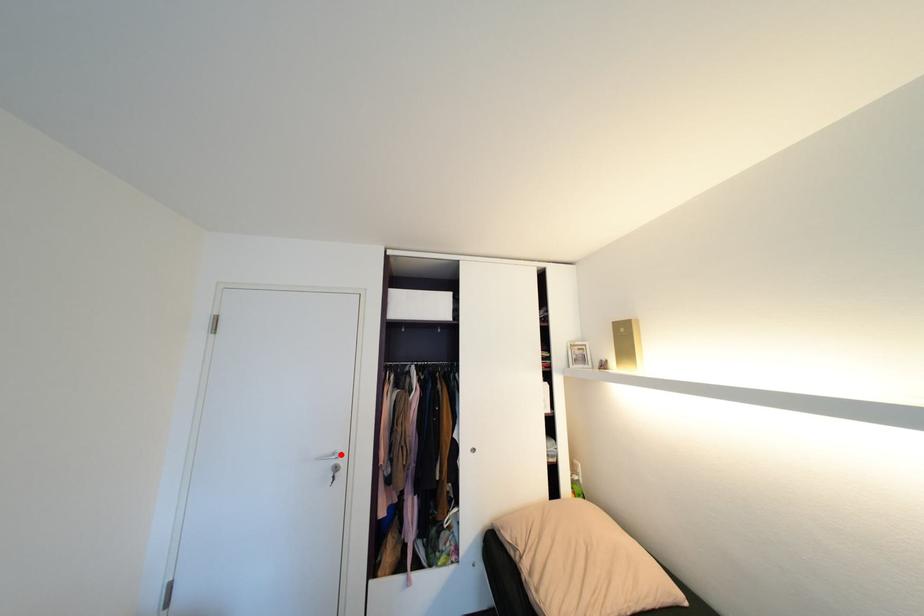
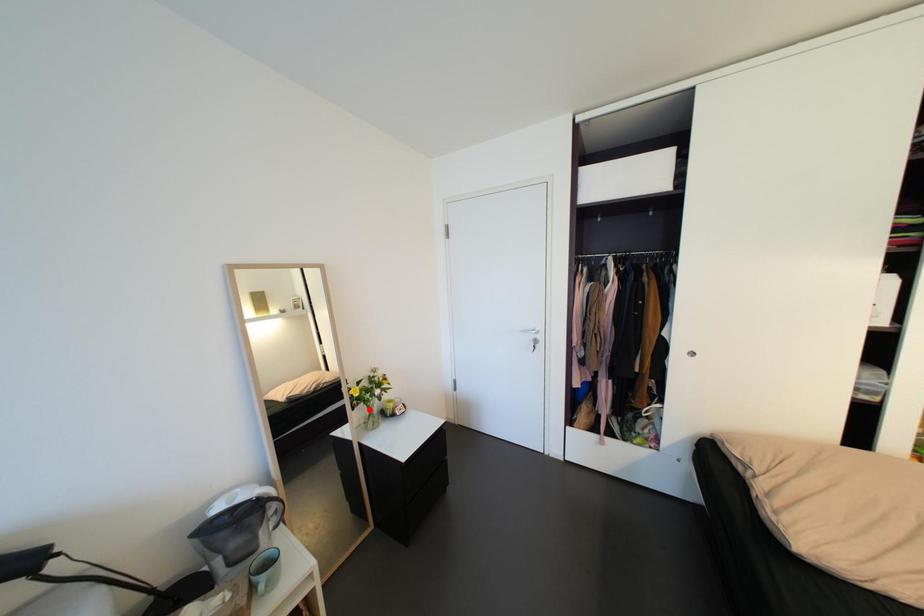
I am providing you with two images of the same scene from different viewpoints. A red point is marked on the first image and another point is marked on the second image. Is the marked point in image1 the same physical position as the marked point in image2?

No